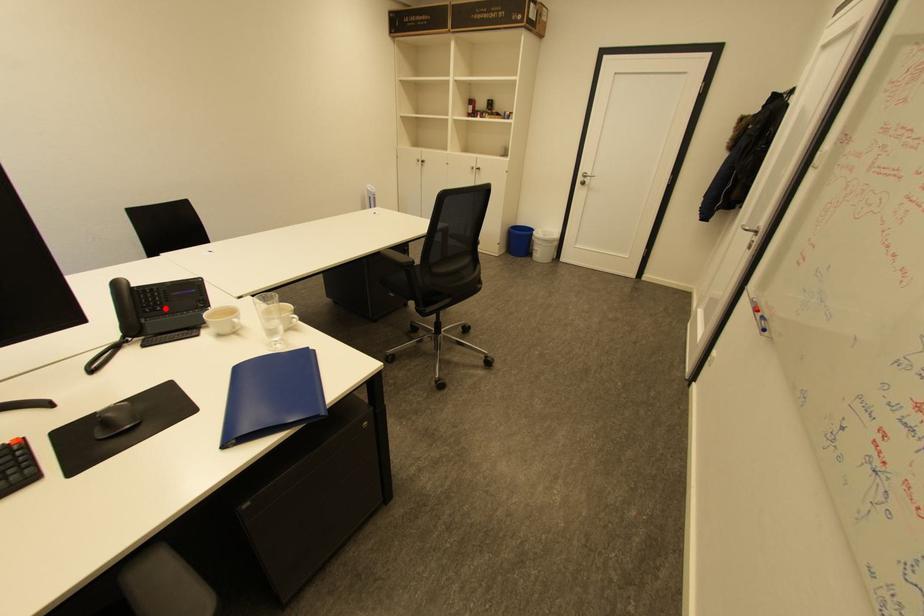
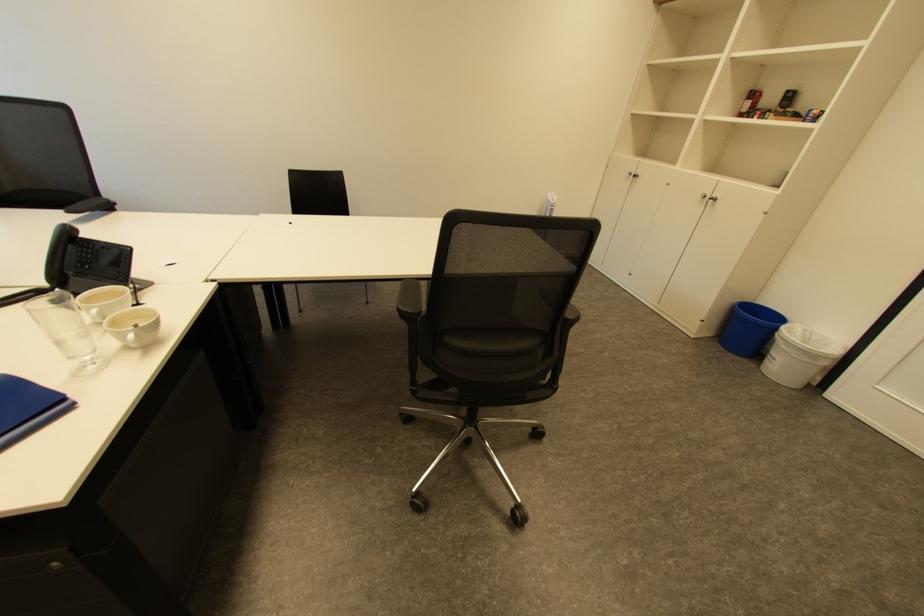
Find the pixel in the second image that matches the highlighted location in the first image.

(92, 267)